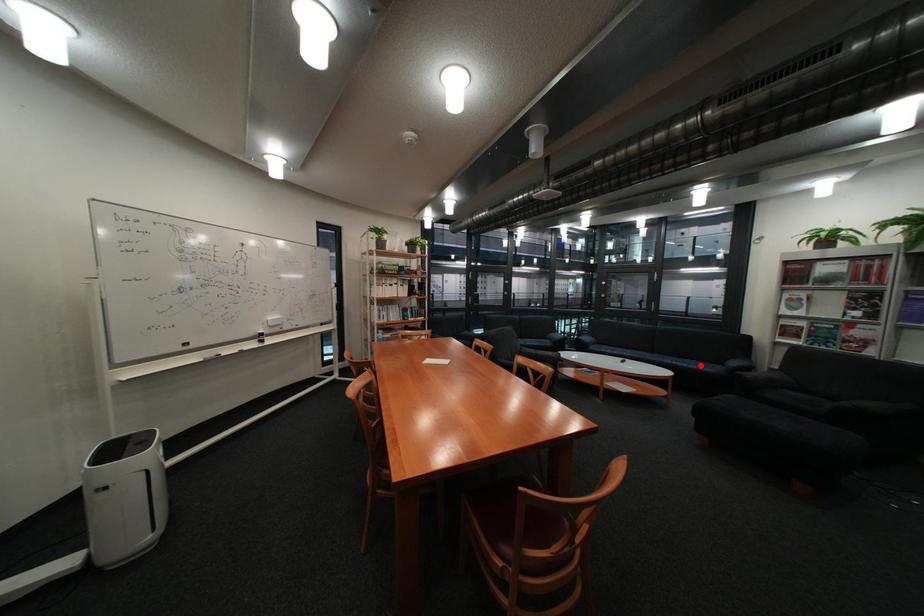
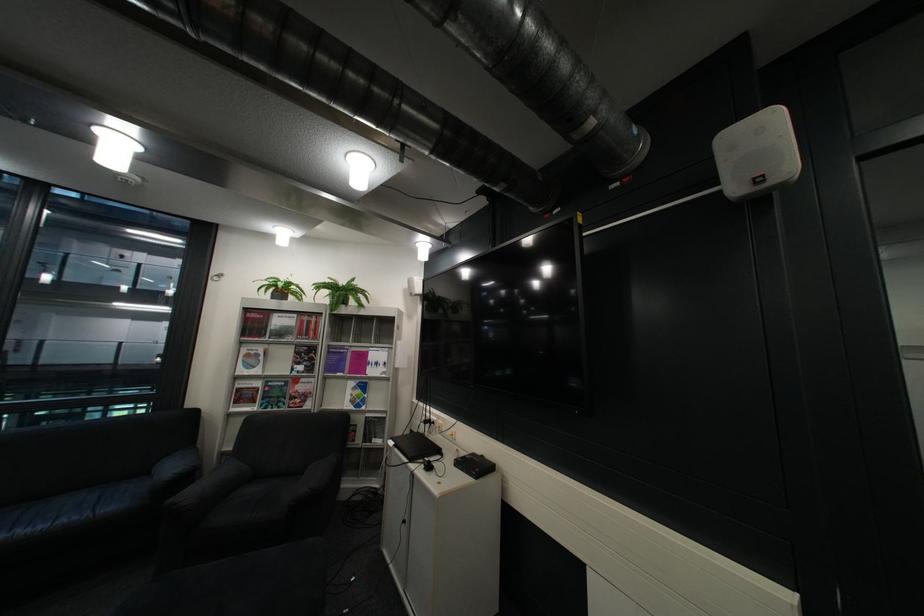
Question: A red point is marked in image1. In image2, is the corresponding 3D point closer to the camera or farther? Reply with the corresponding letter.

Choices:
 (A) The corresponding 3D point is closer.
 (B) The corresponding 3D point is farther.

Answer: (A)